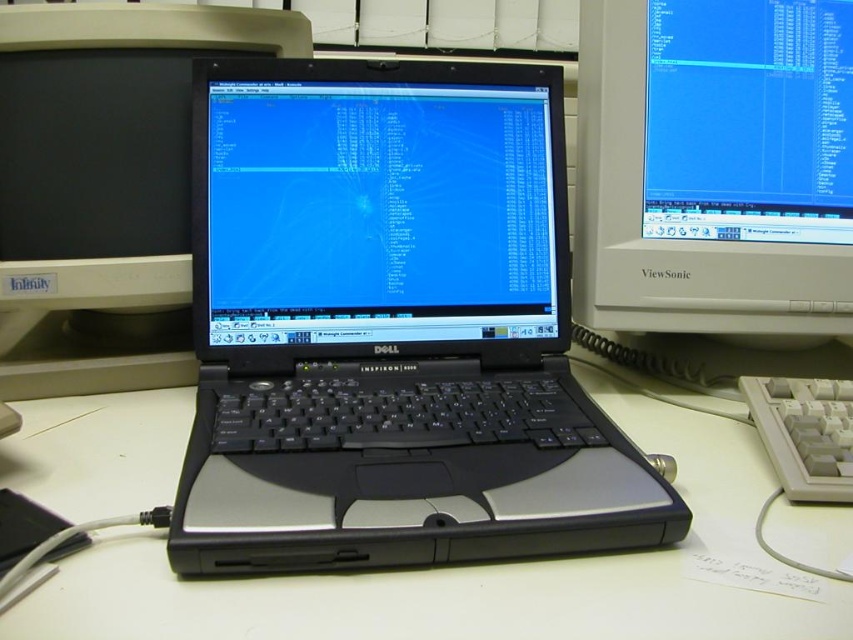
Question: Which point is farther to the camera?

Choices:
 (A) white plastic keyboard at lower right
 (B) matte black screen at center
 (C) black plastic laptop at center
 (D) white matte table at center

Answer: (B)

Question: Does matte black screen at center appear on the left side of white matte table at center?

Choices:
 (A) no
 (B) yes

Answer: (B)

Question: Based on their relative distances, which object is nearer to the white plastic monitor at right?

Choices:
 (A) white plastic keyboard at lower right
 (B) matte black laptop at center
 (C) white matte table at center
 (D) black plastic laptop at center

Answer: (D)

Question: Which object is the farthest from the black plastic laptop at center?

Choices:
 (A) white plastic keyboard at lower right
 (B) matte black laptop at center
 (C) white plastic monitor at right
 (D) white matte table at center

Answer: (A)

Question: From the image, what is the correct spatial relationship of black plastic laptop at center in relation to white matte table at center?

Choices:
 (A) right
 (B) left

Answer: (B)

Question: Is matte black screen at center wider than matte black laptop at center?

Choices:
 (A) no
 (B) yes

Answer: (A)